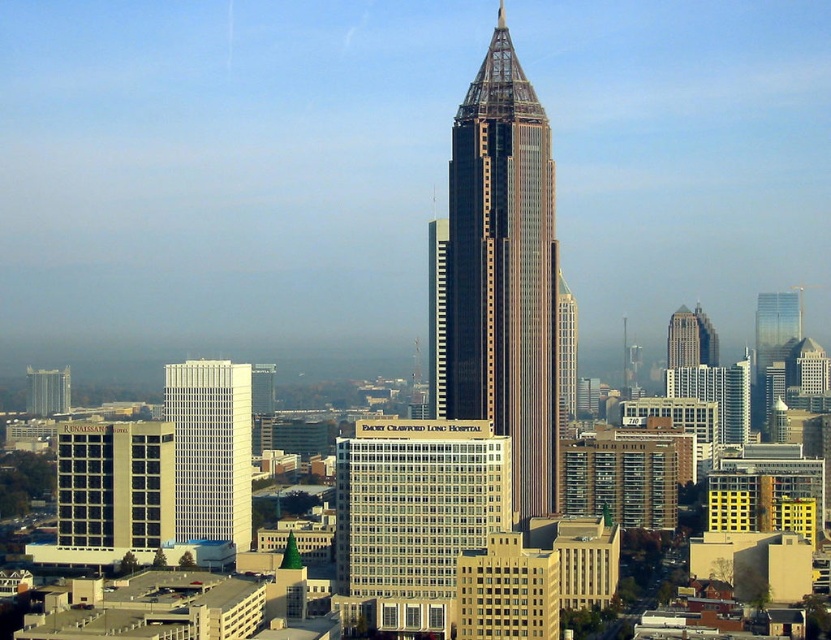
Question: Is white glass building at center closer to the viewer compared to matte glass skyscraper at left?

Choices:
 (A) yes
 (B) no

Answer: (A)

Question: Which is farther from the white glass building at center-left?

Choices:
 (A) matte glass skyscraper at left
 (B) white glass building at center

Answer: (B)

Question: Which of these objects is positioned closest to the shiny glass skyscraper at center?

Choices:
 (A) white glass building at center
 (B) white glass building at center-left
 (C) matte glass skyscraper at left

Answer: (A)

Question: Among these points, which one is farthest from the camera?

Choices:
 (A) (42, 413)
 (B) (175, 413)
 (C) (416, 458)

Answer: (A)

Question: Does white glass building at center appear under matte glass skyscraper at left?

Choices:
 (A) yes
 (B) no

Answer: (A)

Question: Is shiny glass skyscraper at center to the left of white glass building at center-left from the viewer's perspective?

Choices:
 (A) yes
 (B) no

Answer: (B)